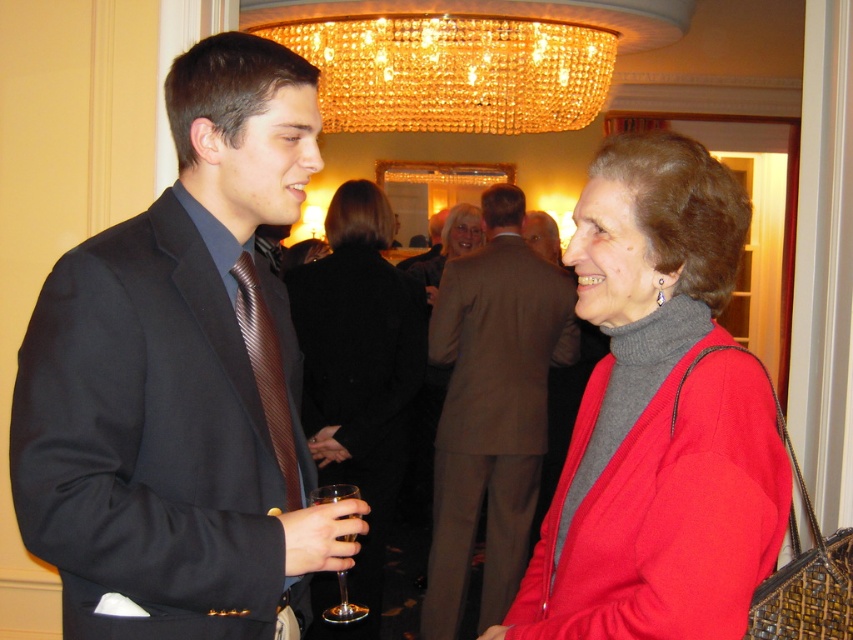
You are at a formal event and notice two items in your line of sight. The brown striped tie at left and the clear glass wine glass at lower left. Which item is closer to you?

The brown striped tie at left is closer to you because it is further to the viewer than the clear glass wine glass at lower left.

You are a photographer at the event and want to capture a photo of the two people in the foreground without any obstructions. Which object between the brown striped tie at left and the clear glass wine glass at lower left is closer to the camera, so you can ensure it doesn

The brown striped tie at left is positioned on the left side of the clear glass wine glass at lower left, meaning it is closer to the camera. To avoid obstruction, ensure the clear glass wine glass at lower left is not blocking the view by focusing on the brown striped tie at left first.